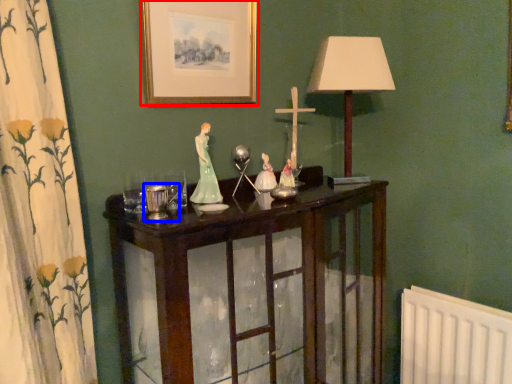
Question: Which object is closer to the camera taking this photo, picture frame (highlighted by a red box) or candle holder (highlighted by a blue box)?

Choices:
 (A) picture frame
 (B) candle holder

Answer: (B)